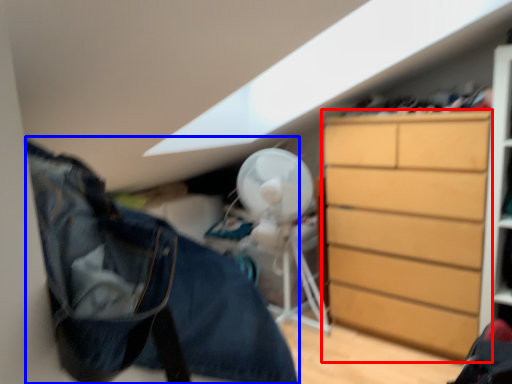
Question: Among these objects, which one is farthest to the camera, chest of drawers (highlighted by a red box) or clothing (highlighted by a blue box)?

Choices:
 (A) chest of drawers
 (B) clothing

Answer: (A)